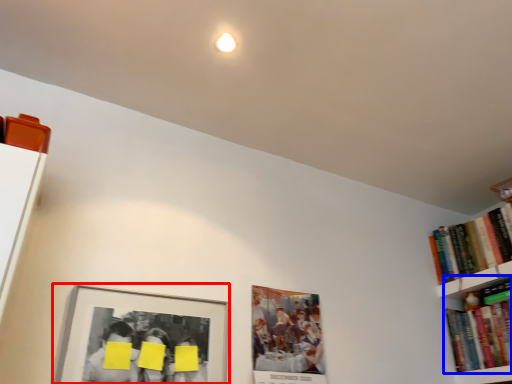
Question: Which of the following is the farthest to the observer, picture frame (highlighted by a red box) or book (highlighted by a blue box)?

Choices:
 (A) picture frame
 (B) book

Answer: (B)